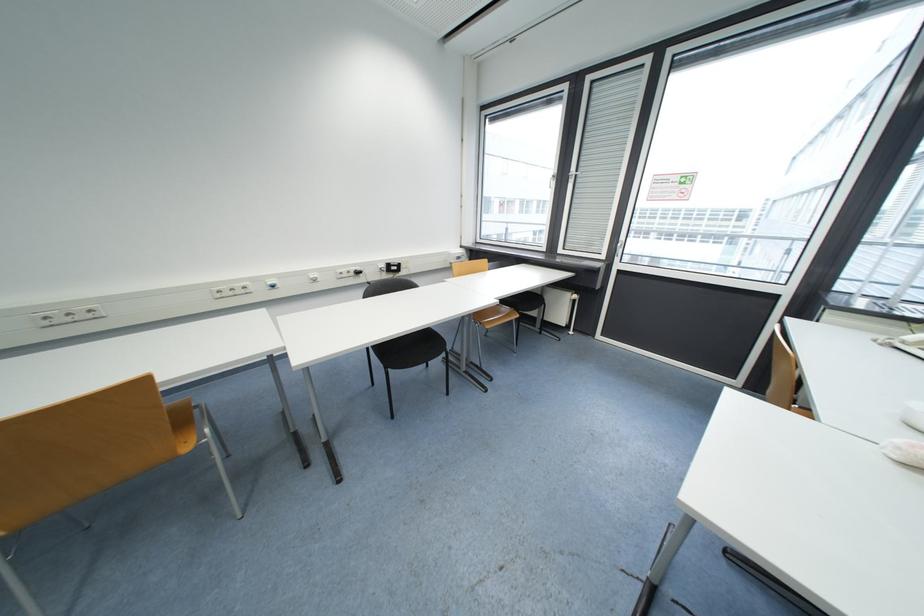
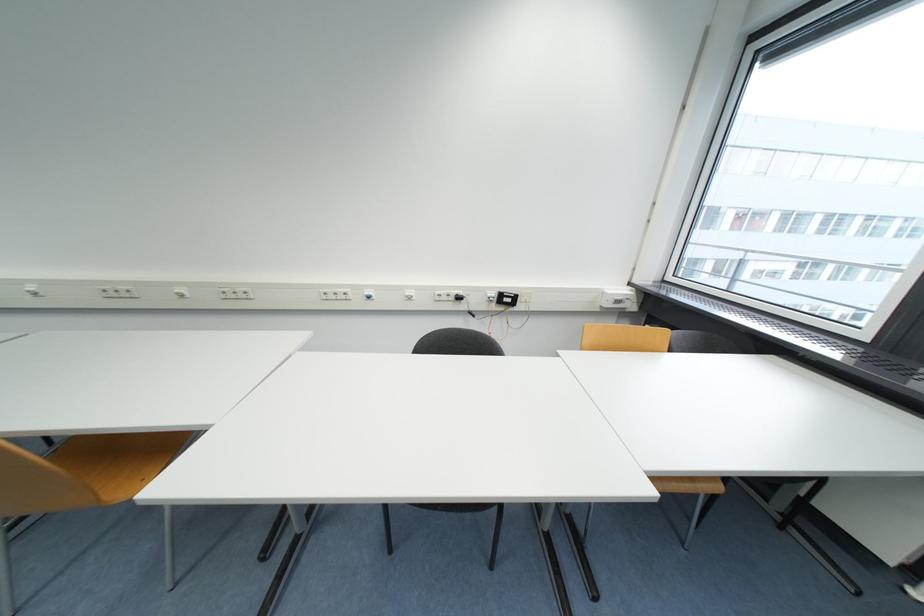
Question: The camera is either moving clockwise (left) or counter-clockwise (right) around the object. The first image is from the beginning of the video and the second image is from the end. Is the camera moving left or right when shooting the video?

Choices:
 (A) Left
 (B) Right

Answer: (B)